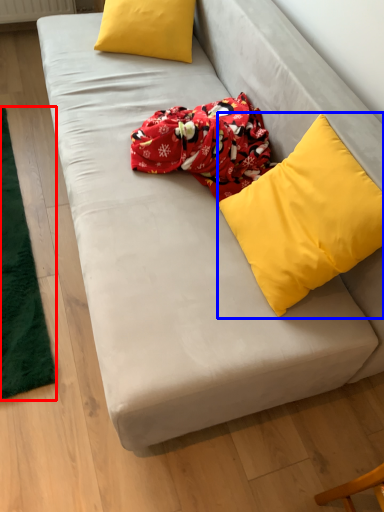
Question: Among these objects, which one is nearest to the camera, mat (highlighted by a red box) or pillow (highlighted by a blue box)?

Choices:
 (A) mat
 (B) pillow

Answer: (B)